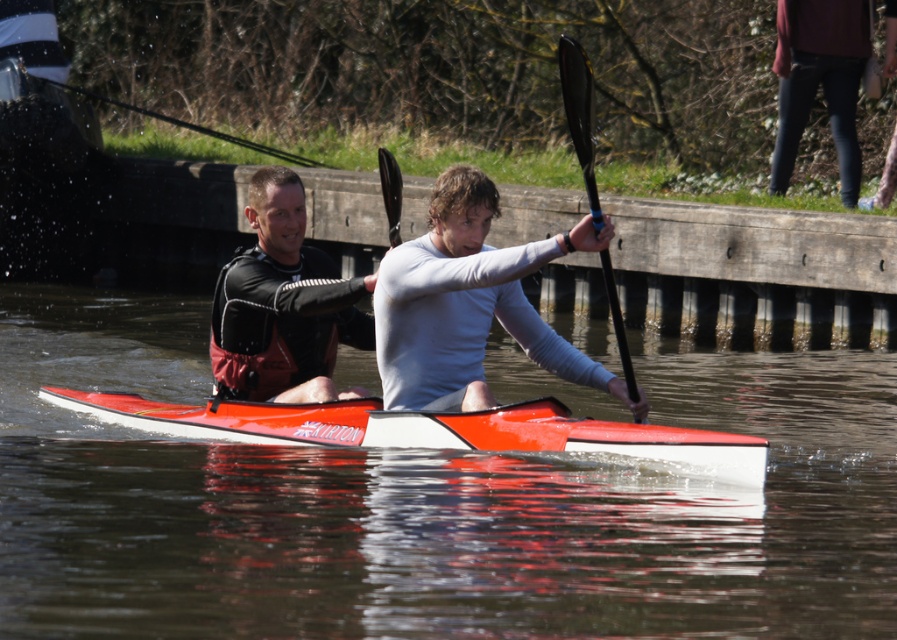
Question: Observing the image, what is the correct spatial positioning of transparent water at center in reference to black rubber paddle at center?

Choices:
 (A) below
 (B) above

Answer: (A)

Question: Does transparent water at center lie in front of black rubber paddle at upper center?

Choices:
 (A) yes
 (B) no

Answer: (A)

Question: Which object is the farthest from the transparent water at center?

Choices:
 (A) black rubber paddle at center
 (B) black neoprene wetsuit at left
 (C) black rubber paddle at upper center

Answer: (A)

Question: Which is farther from the white matte kayak at center?

Choices:
 (A) shiny orange kayak at center
 (B) black rubber paddle at upper center
 (C) transparent water at center
 (D) black neoprene wetsuit at left

Answer: (C)

Question: Which of the following is the farthest from the observer?

Choices:
 (A) (84, 394)
 (B) (567, 88)

Answer: (A)

Question: Can you confirm if transparent water at center is positioned above white matte kayak at center?

Choices:
 (A) yes
 (B) no

Answer: (B)